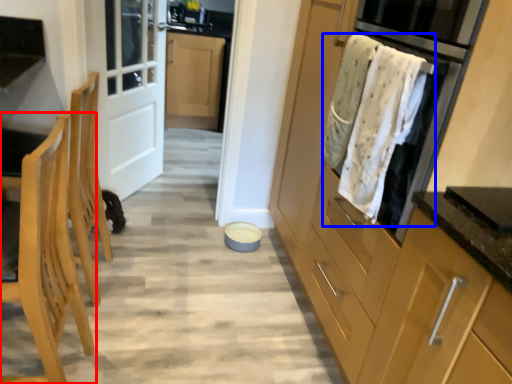
Question: Which of the following is the farthest to the observer, chair (highlighted by a red box) or blanket (highlighted by a blue box)?

Choices:
 (A) chair
 (B) blanket

Answer: (B)